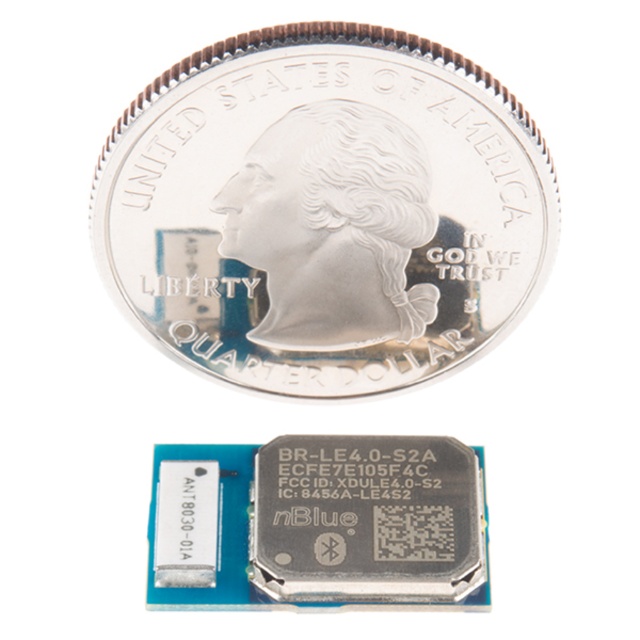
You are an engineer inspecting a circuit board with two silver metallic coins. You need to place a new component that requires 2 cm of vertical space between them. The silver metallic coin at center and the silver metallic coin at upper center are both in your way. Which coin should you move to ensure enough space?

The silver metallic coin at center is taller than the silver metallic coin at upper center. To create 2 cm of vertical space between them, you should move the taller silver metallic coin at center since it occupies more vertical space and adjusting its position would allow for the required clearance.

You are an engineer inspecting a circuit board with two silver metallic coins. The coins are labeled as the silver metallic coin at center and the silver metallic coin at upper center. Based on their positions, which coin would cast a larger shadow if a light is shone directly above them?

The silver metallic coin at center would cast a larger shadow because it is wider than the silver metallic coin at upper center.